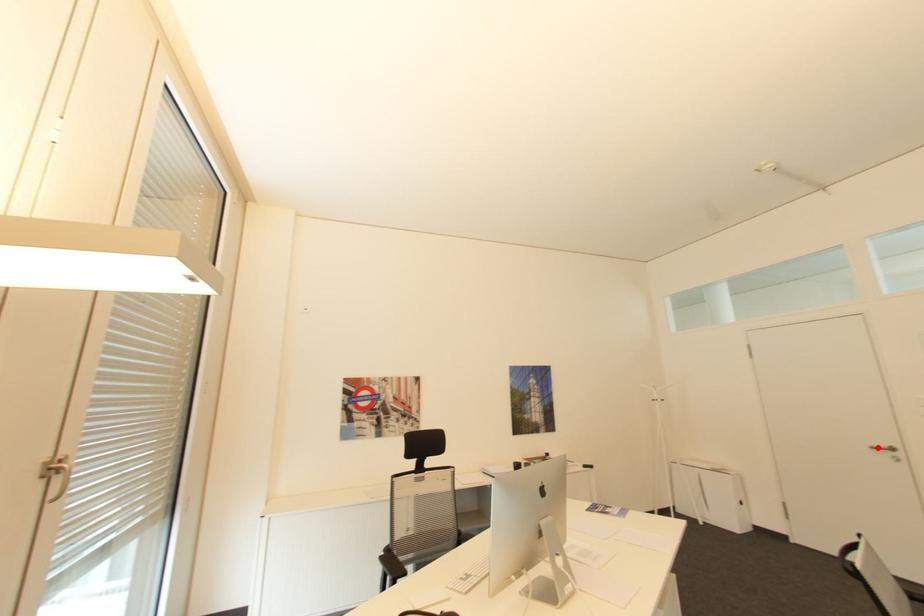
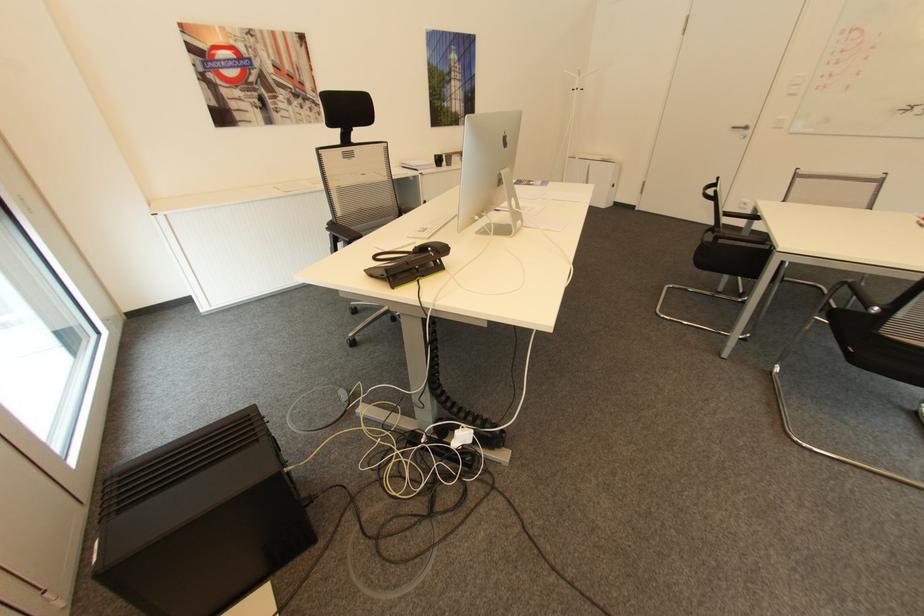
Question: I am providing you with two images of the same scene from different viewpoints. In image1, a red point is highlighted. Considering the same 3D point in image2, which of the following is correct?

Choices:
 (A) It is closer
 (B) It is farther

Answer: (B)